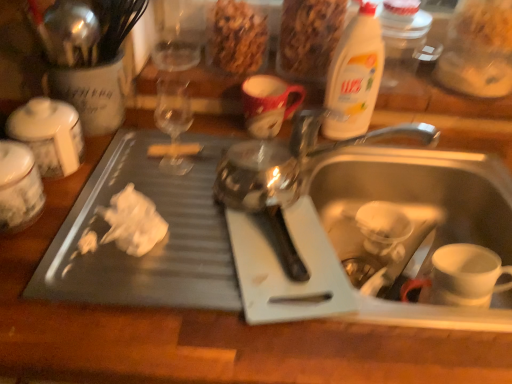
Question: Does granular brown cereal at upper center, marked as the 2th food in a left-to-right arrangement, come in front of white matte coffee cup at sink bottom?

Choices:
 (A) no
 (B) yes

Answer: (A)

Question: Does granular brown cereal at upper center, marked as the 2th food in a left-to-right arrangement, have a greater height compared to white matte coffee cup at sink bottom?

Choices:
 (A) no
 (B) yes

Answer: (B)

Question: From the image's perspective, is granular brown cereal at upper center, marked as the 2th food in a left-to-right arrangement, on top of white matte coffee cup at sink bottom?

Choices:
 (A) no
 (B) yes

Answer: (B)

Question: From a real-world perspective, is granular brown cereal at upper center, positioned as the first food in right-to-left order, on white matte coffee cup at sink bottom?

Choices:
 (A) no
 (B) yes

Answer: (B)

Question: Does granular brown cereal at upper center, marked as the 2th food in a left-to-right arrangement, turn towards white matte coffee cup at sink bottom?

Choices:
 (A) yes
 (B) no

Answer: (A)

Question: Considering the relative positions of granular brown cereal at upper center, marked as the 2th food in a left-to-right arrangement, and white matte coffee cup at sink bottom in the image provided, is granular brown cereal at upper center, marked as the 2th food in a left-to-right arrangement, to the left of white matte coffee cup at sink bottom from the viewer's perspective?

Choices:
 (A) no
 (B) yes

Answer: (B)

Question: Is white matte coffee cup at sink bottom positioned far away from white plastic bottle at upper right?

Choices:
 (A) yes
 (B) no

Answer: (B)

Question: Can we say white matte coffee cup at sink bottom lies outside white plastic bottle at upper right?

Choices:
 (A) no
 (B) yes

Answer: (B)

Question: Is white matte coffee cup at sink bottom directly adjacent to white plastic bottle at upper right?

Choices:
 (A) yes
 (B) no

Answer: (B)

Question: Does white matte coffee cup at sink bottom have a smaller size compared to white plastic bottle at upper right?

Choices:
 (A) yes
 (B) no

Answer: (A)

Question: From the image's perspective, is white matte coffee cup at sink bottom on white plastic bottle at upper right?

Choices:
 (A) no
 (B) yes

Answer: (A)

Question: From the image's perspective, is white matte coffee cup at sink bottom under white plastic bottle at upper right?

Choices:
 (A) no
 (B) yes

Answer: (B)

Question: Is white plastic bottle at upper right at the left side of white matte coffee cup at sink bottom?

Choices:
 (A) yes
 (B) no

Answer: (A)